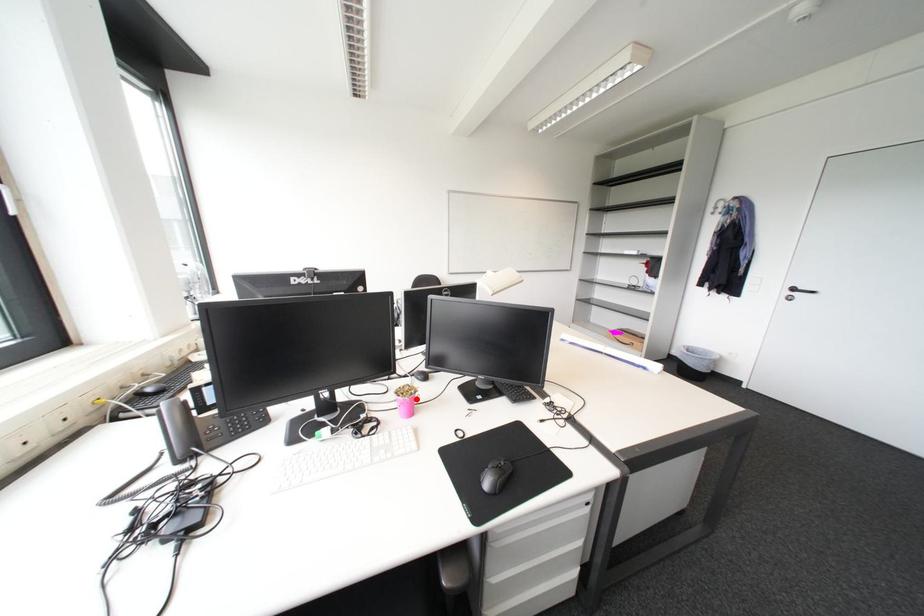
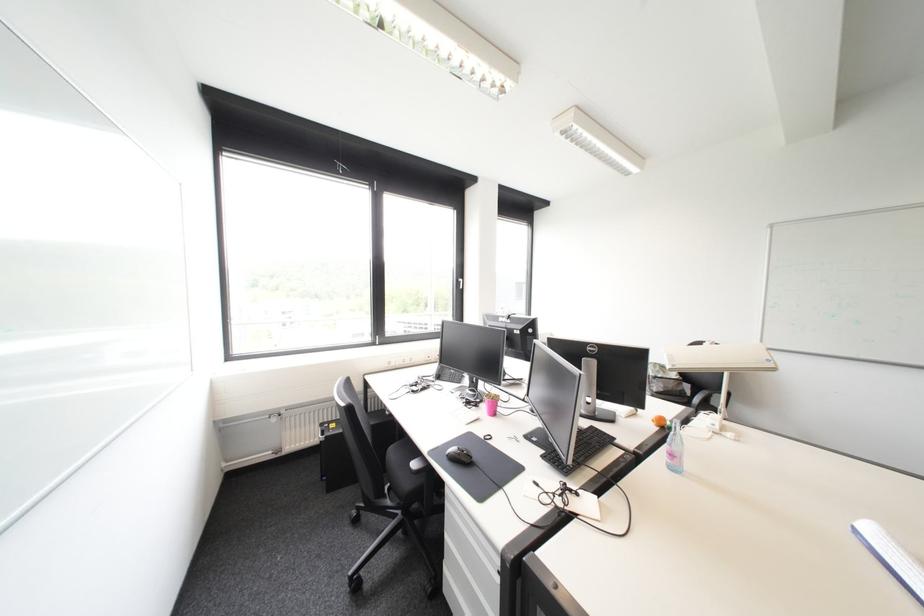
Question: I am providing you with two images of the same scene from different viewpoints. Given a red point in image1, look at the same physical point in image2. Is it:

Choices:
 (A) Closer to the viewpoint
 (B) Farther from the viewpoint

Answer: (B)